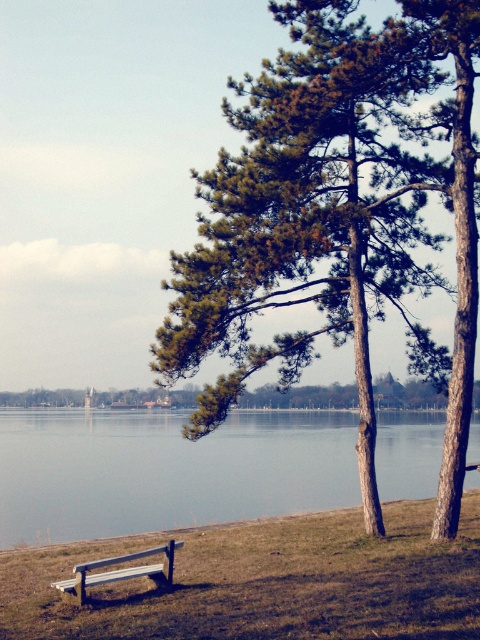
Question: Does green needle-like leaves at center have a larger size compared to clear water at bench left?

Choices:
 (A) no
 (B) yes

Answer: (A)

Question: Among these points, which one is nearest to the camera?

Choices:
 (A) (256, 428)
 (B) (363, 116)
 (C) (78, 586)
 (D) (254, 564)

Answer: (C)

Question: Is brown grassy at lower center smaller than wooden park bench at lower left?

Choices:
 (A) no
 (B) yes

Answer: (A)

Question: Does green needle-like leaves at center appear on the left side of brown grassy at lower center?

Choices:
 (A) no
 (B) yes

Answer: (A)

Question: Which object appears closest to the camera in this image?

Choices:
 (A) clear water at bench left
 (B) wooden park bench at lower left

Answer: (B)

Question: Estimate the real-world distances between objects in this image. Which object is farther from the brown grassy at lower center?

Choices:
 (A) green needle-like leaves at center
 (B) wooden park bench at lower left
 (C) clear water at bench left

Answer: (C)